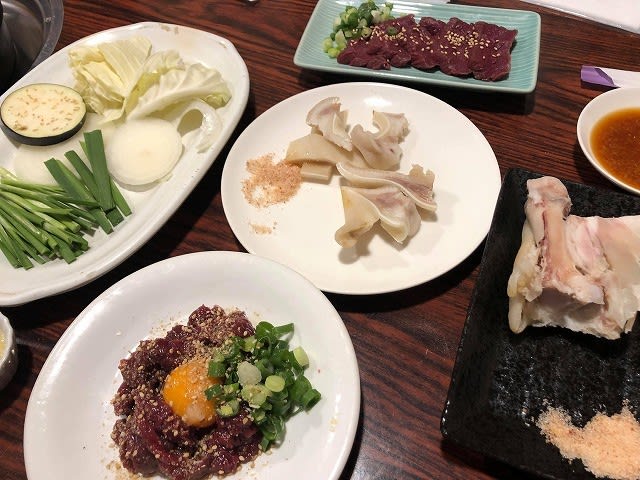
The width and height of the screenshot is (640, 480). Find the location of `black plate`. black plate is located at coordinates (495, 436).